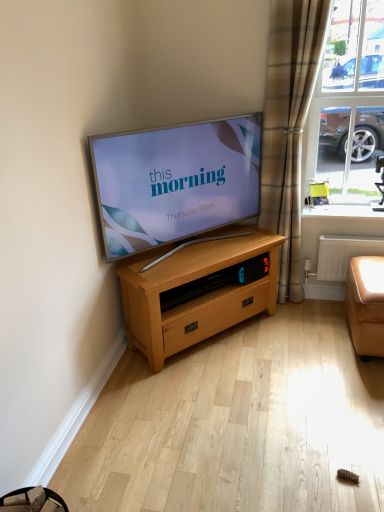
Question: Is white plastic radiator at lower right looking in the opposite direction of light oak wooden chest of drawers at center?

Choices:
 (A) no
 (B) yes

Answer: (A)

Question: From a real-world perspective, does white plastic radiator at lower right stand above light oak wooden chest of drawers at center?

Choices:
 (A) no
 (B) yes

Answer: (B)

Question: Does white plastic radiator at lower right have a lesser height compared to light oak wooden chest of drawers at center?

Choices:
 (A) no
 (B) yes

Answer: (B)

Question: Is light oak wooden chest of drawers at center completely or partially inside white plastic radiator at lower right?

Choices:
 (A) no
 (B) yes

Answer: (A)

Question: Can you confirm if white plastic radiator at lower right is thinner than light oak wooden chest of drawers at center?

Choices:
 (A) no
 (B) yes

Answer: (B)

Question: Considering the relative positions of tan leather armchair at right and clear glass window at upper right in the image provided, is tan leather armchair at right to the left or to the right of clear glass window at upper right?

Choices:
 (A) right
 (B) left

Answer: (B)

Question: Would you say tan leather armchair at right is inside or outside clear glass window at upper right?

Choices:
 (A) outside
 (B) inside

Answer: (A)

Question: From a real-world perspective, is tan leather armchair at right positioned above or below clear glass window at upper right?

Choices:
 (A) above
 (B) below

Answer: (B)

Question: Is tan leather armchair at right taller or shorter than clear glass window at upper right?

Choices:
 (A) short
 (B) tall

Answer: (A)

Question: Is tan leather armchair at right inside the boundaries of white plastic radiator at lower right, or outside?

Choices:
 (A) outside
 (B) inside

Answer: (A)

Question: Considering the positions of tan leather armchair at right and white plastic radiator at lower right in the image, is tan leather armchair at right bigger or smaller than white plastic radiator at lower right?

Choices:
 (A) big
 (B) small

Answer: (B)

Question: From the image's perspective, relative to white plastic radiator at lower right, is tan leather armchair at right above or below?

Choices:
 (A) above
 (B) below

Answer: (A)

Question: From a real-world perspective, is tan leather armchair at right positioned above or below white plastic radiator at lower right?

Choices:
 (A) above
 (B) below

Answer: (A)

Question: Considering the positions of white glossy window sill at upper right and tan leather armchair at right in the image, is white glossy window sill at upper right taller or shorter than tan leather armchair at right?

Choices:
 (A) short
 (B) tall

Answer: (A)

Question: Would you say white glossy window sill at upper right is inside or outside tan leather armchair at right?

Choices:
 (A) outside
 (B) inside

Answer: (A)